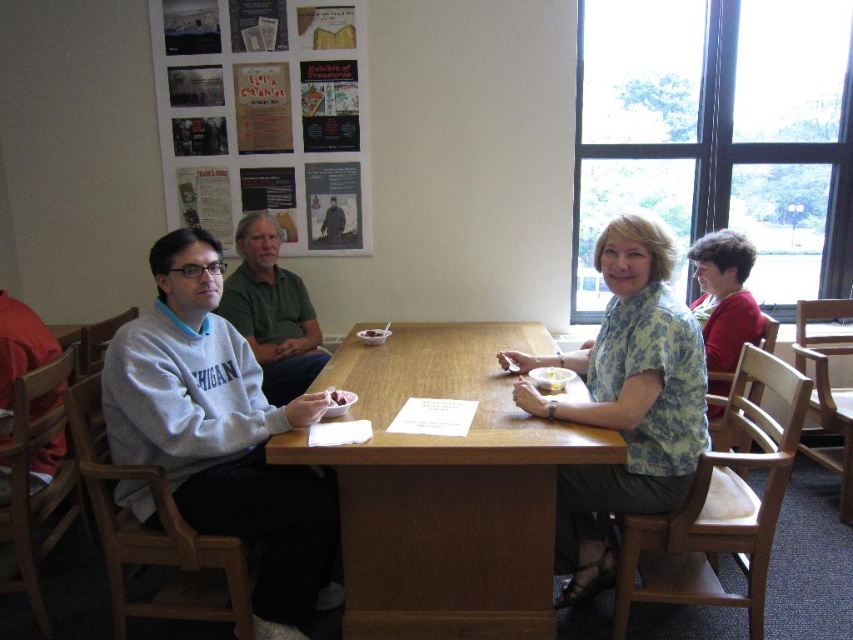
You are standing in the room and want to place a small plant between the two points, point (x=218, y=420) and point (x=247, y=291). Which point should the plant be closer to in order to be at the same depth as the table?

The plant should be closer to point (x=218, y=420) because it is closer to the camera than point (x=247, y=291), so placing it there would align it with the table depth.